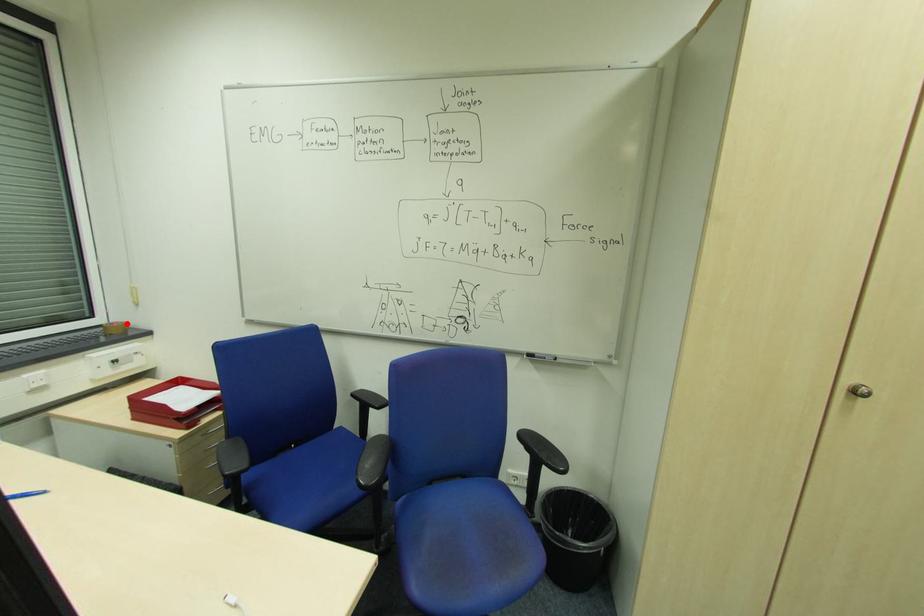
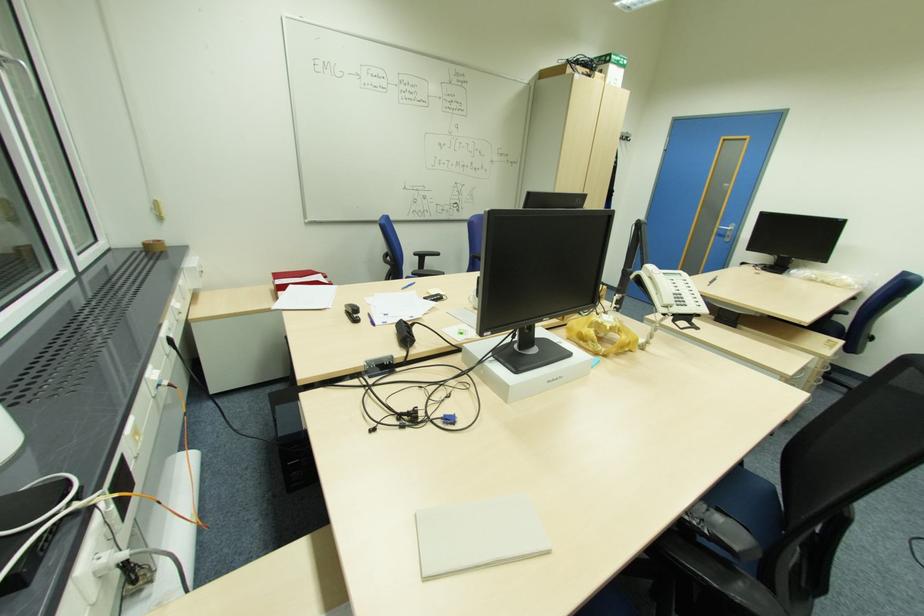
In the second image, find the point that corresponds to the highlighted location in the first image.

(162, 241)